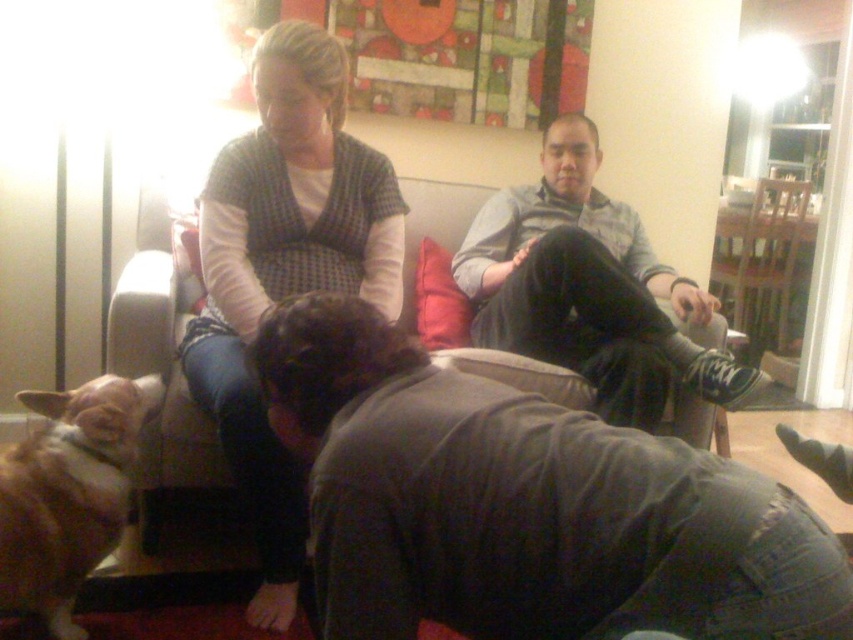
Who is shorter, beige fabric couch at center or wooden chair at right?

wooden chair at right

What are the coordinates of `beige fabric couch at center` in the screenshot? It's located at (163, 360).

Is point (483, 358) farther from viewer compared to point (779, 268)?

No, it is not.

Where is `beige fabric couch at center`? This screenshot has height=640, width=853. beige fabric couch at center is located at coordinates (163, 360).

Image resolution: width=853 pixels, height=640 pixels. What do you see at coordinates (285, 269) in the screenshot?
I see `matte black sweater at center` at bounding box center [285, 269].

Which of these two, matte black sweater at center or beige fabric couch at center, stands taller?

Standing taller between the two is matte black sweater at center.

Find the location of a particular element. This screenshot has height=640, width=853. matte black sweater at center is located at coordinates (285, 269).

From the picture: Who is shorter, dark gray sweater at center or beige fabric couch at center?

dark gray sweater at center is shorter.

Can you confirm if dark gray sweater at center is thinner than beige fabric couch at center?

A: No, dark gray sweater at center is not thinner than beige fabric couch at center.

Which is in front, point (540, 273) or point (199, 417)?

Point (199, 417)

Find the location of a particular element. The width and height of the screenshot is (853, 640). dark gray sweater at center is located at coordinates (589, 289).